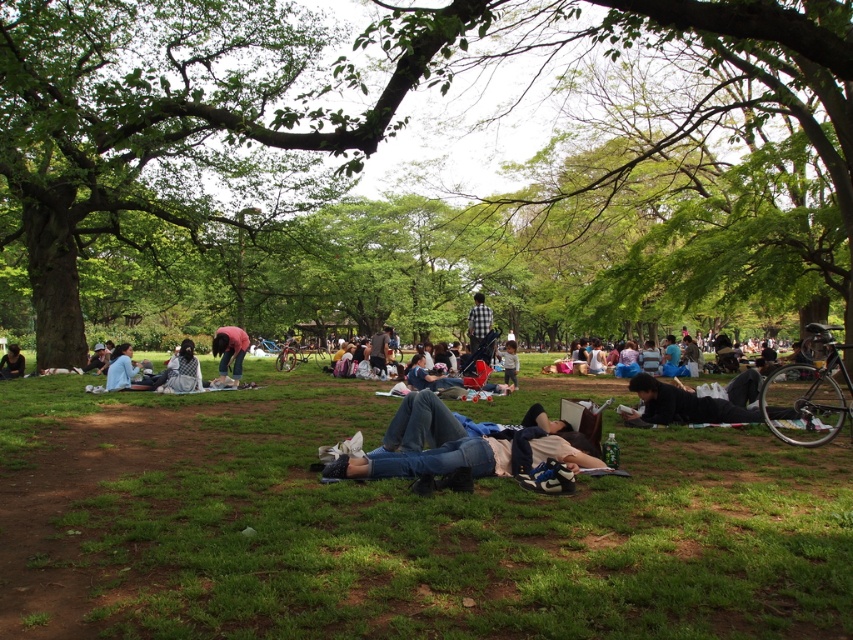
You are standing in the park and see the green leafy tree at center and the light blue shirt at lower left. Which object is positioned to the right of the other?

The green leafy tree at center is to the right of the light blue shirt at lower left.

You are planning to set up a picnic blanket in the park. The green leafy tree at center and the denim jeans at center are in your way. Which object is wider so you need to move it first?

The green leafy tree at center is wider than the denim jeans at center, so you need to move it first.